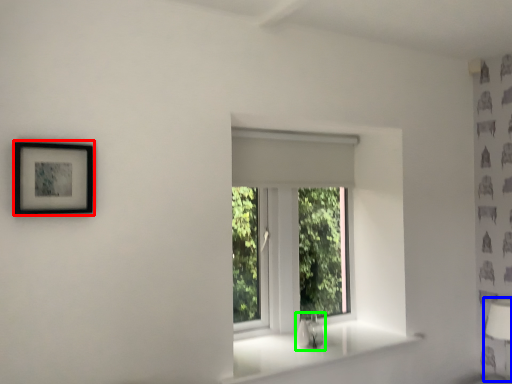
Question: Estimate the real-world distances between objects in this image. Which object is farther from picture frame (highlighted by a red box), table lamp (highlighted by a blue box) or sink (highlighted by a green box)?

Choices:
 (A) table lamp
 (B) sink

Answer: (A)